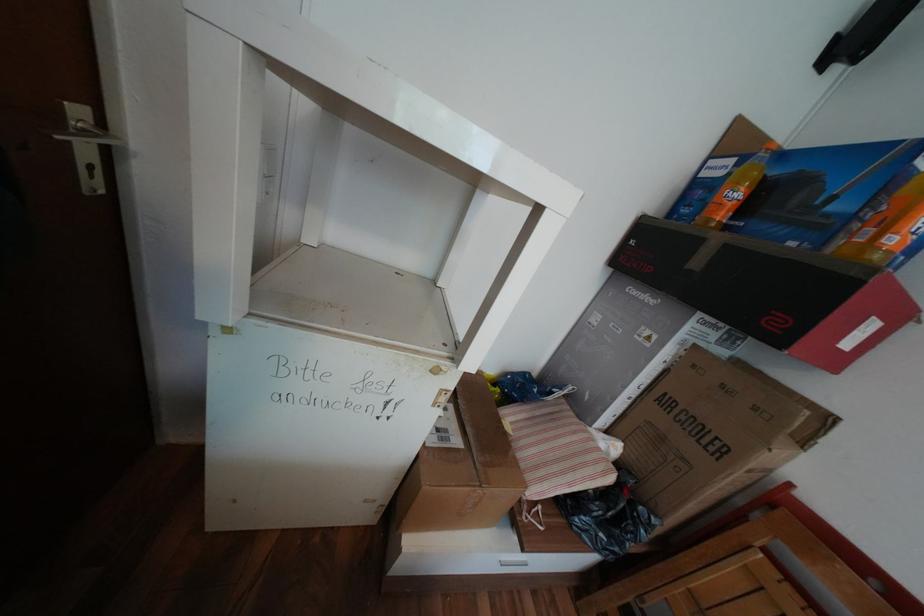
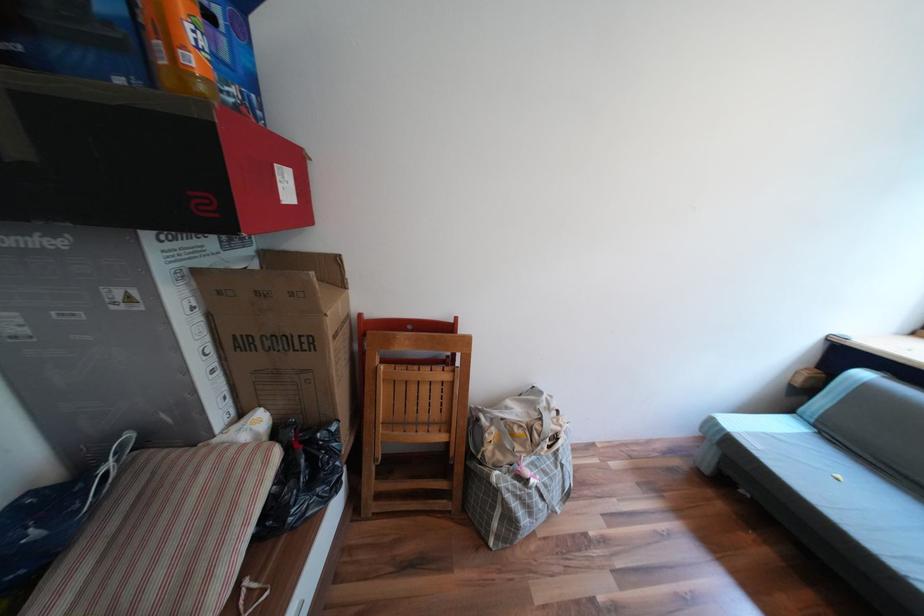
Where in the second image is the point corresponding to the point at 651,387 from the first image?

(219, 349)